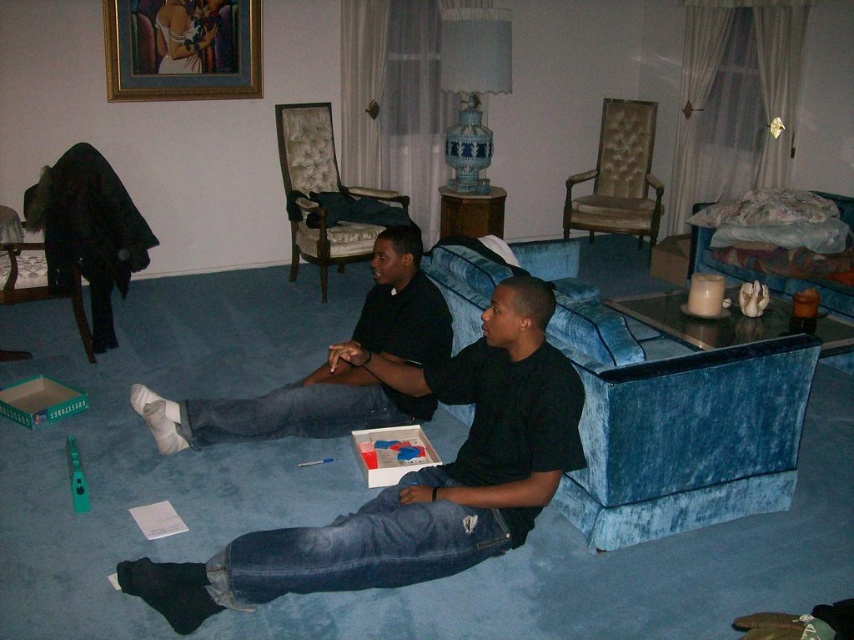
You are planning to place a small table between the velvet upholstered armchair at center and the velvet armchair at left. Based on their positions, which armchair should the table be closer to?

The velvet upholstered armchair at center is above the velvet armchair at left, so the table should be placed closer to the velvet armchair at left to ensure stability and accessibility.

You are standing in the living room and want to place a small plant between the two points, point (583, 308) and point (316, 230). Which point should the plant be closer to so it is positioned in front of the other point?

The plant should be closer to point (583, 308) because it is in front of point (316, 230).